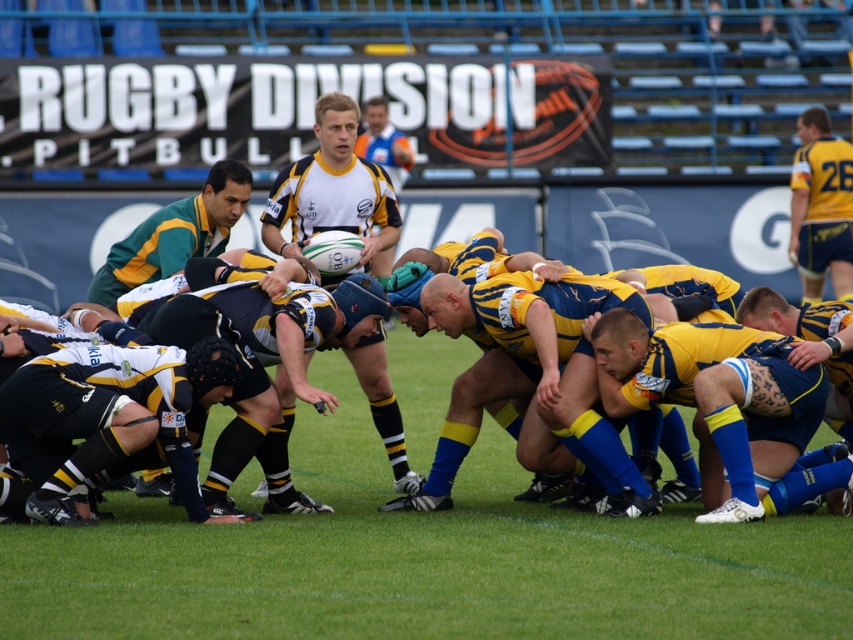
You are a sports analyst watching the rugby scrum. You notice the blue matte shorts at center and the white matte rugby ball at center. Which object is positioned to the right of the other?

The blue matte shorts at center is to the right of the white matte rugby ball at center.

You are a referee observing the rugby scrum. You notice the blue matte shorts at center and the white matte rugby ball at center. Which object is higher in position?

The blue matte shorts at center is much taller than the white matte rugby ball at center, so the blue matte shorts at center is higher in position.